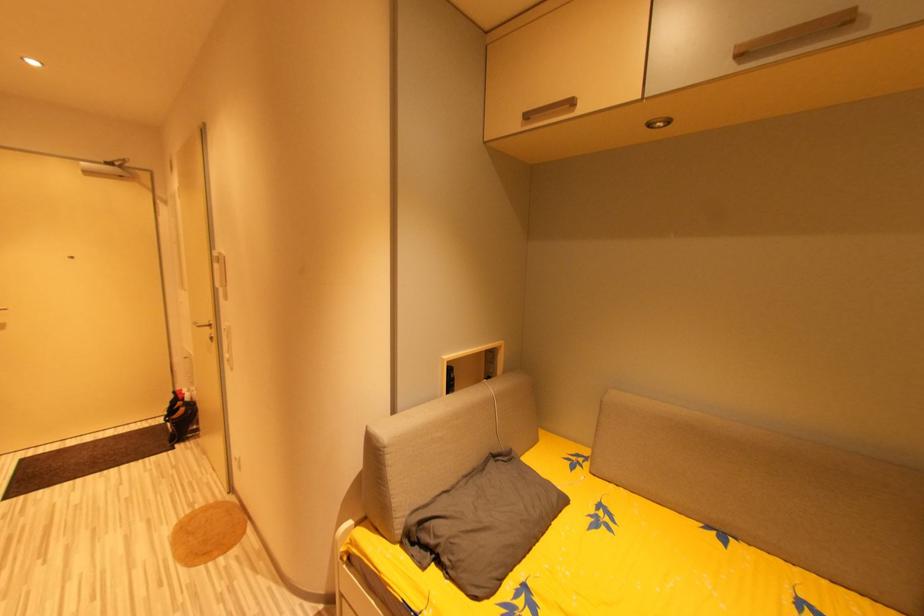
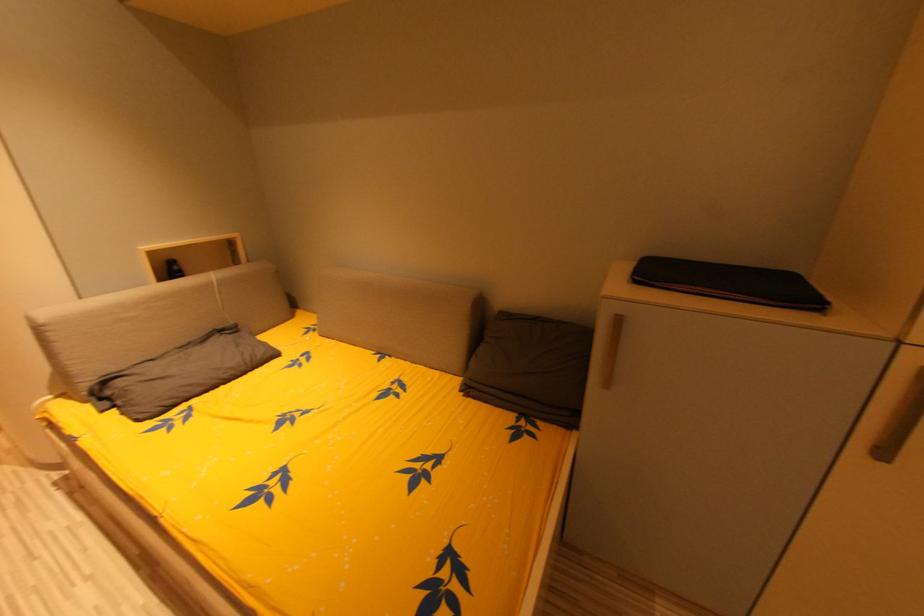
Which direction would the cameraman need to move to produce the second image?

The cameraman moved toward right, backward.